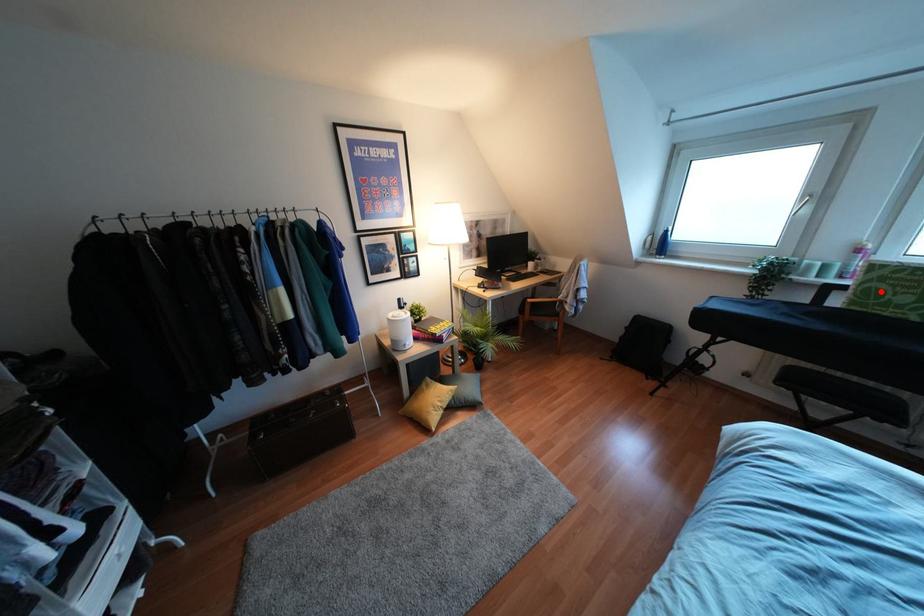
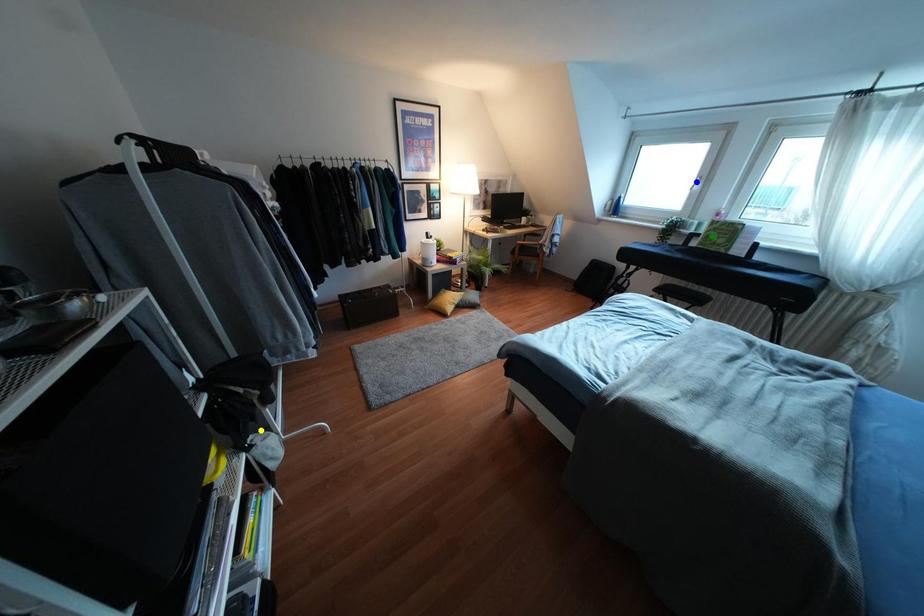
Question: I am providing you with two images of the same scene from different viewpoints. A red point is marked on the first image. You are given multiple points on the second image. Which mark in image 2 goes with the point in image 1?

Choices:
 (A) yellow point
 (B) blue point
 (C) green point

Answer: (C)